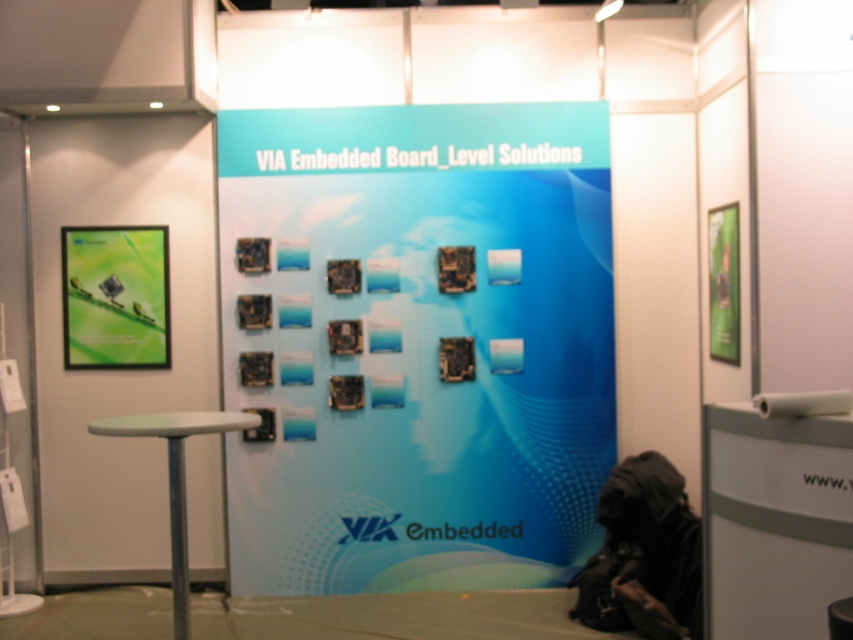
Does green glossy poster at upper left lie behind white plastic stool at lower left?

That is True.

This screenshot has height=640, width=853. What do you see at coordinates (115, 296) in the screenshot?
I see `green glossy poster at upper left` at bounding box center [115, 296].

Image resolution: width=853 pixels, height=640 pixels. Describe the element at coordinates (115, 296) in the screenshot. I see `green glossy poster at upper left` at that location.

What are the coordinates of `green glossy poster at upper left` in the screenshot? It's located at (115, 296).

Who is higher up, blue glossy board at center or white plastic stool at lower left?

blue glossy board at center

Does point (281, 531) come closer to viewer compared to point (178, 518)?

No, it is not.

This screenshot has width=853, height=640. What do you see at coordinates (415, 342) in the screenshot? I see `blue glossy board at center` at bounding box center [415, 342].

The width and height of the screenshot is (853, 640). In order to click on blue glossy board at center in this screenshot , I will do `click(415, 342)`.

Can you confirm if blue glossy board at center is positioned below green glossy poster at upper left?

Correct, blue glossy board at center is located below green glossy poster at upper left.

Which of these two, blue glossy board at center or green glossy poster at upper left, stands shorter?

With less height is green glossy poster at upper left.

You are a GUI agent. You are given a task and a screenshot of the screen. Output one action in this format:
    pyautogui.click(x=<x>, y=<y>)
    Task: Click on the blue glossy board at center
    The image size is (853, 640).
    Given the screenshot: What is the action you would take?
    pyautogui.click(x=415, y=342)